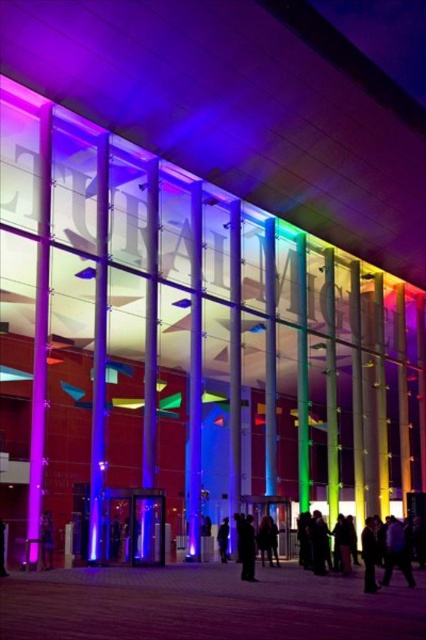
Can you confirm if black leather jacket at lower left is wider than black fabric at center?

No, black leather jacket at lower left is not wider than black fabric at center.

Can you confirm if black leather jacket at lower left is positioned below black fabric at center?

Actually, black leather jacket at lower left is above black fabric at center.

Is point (43, 516) positioned in front of point (221, 552)?

Yes, it is.

Where is `black leather jacket at lower left`? This screenshot has height=640, width=426. black leather jacket at lower left is located at coordinates (46, 540).

Who is shorter, black matte coat at center or black fabric at center?

black fabric at center is shorter.

Can you confirm if black matte coat at center is thinner than black fabric at center?

Incorrect, black matte coat at center's width is not less than black fabric at center's.

Identify the location of black matte coat at center. The image size is (426, 640). (245, 547).

You are a GUI agent. You are given a task and a screenshot of the screen. Output one action in this format:
    pyautogui.click(x=<x>, y=<y>)
    Task: Click on the black matte coat at center
    This screenshot has height=640, width=426.
    Given the screenshot: What is the action you would take?
    pyautogui.click(x=245, y=547)

Who is positioned more to the left, black matte coat at center or black leather jacket at lower left?

black leather jacket at lower left

Where is `black matte coat at center`? black matte coat at center is located at coordinates (245, 547).

Locate an element on the screen. This screenshot has height=640, width=426. black matte coat at center is located at coordinates (245, 547).